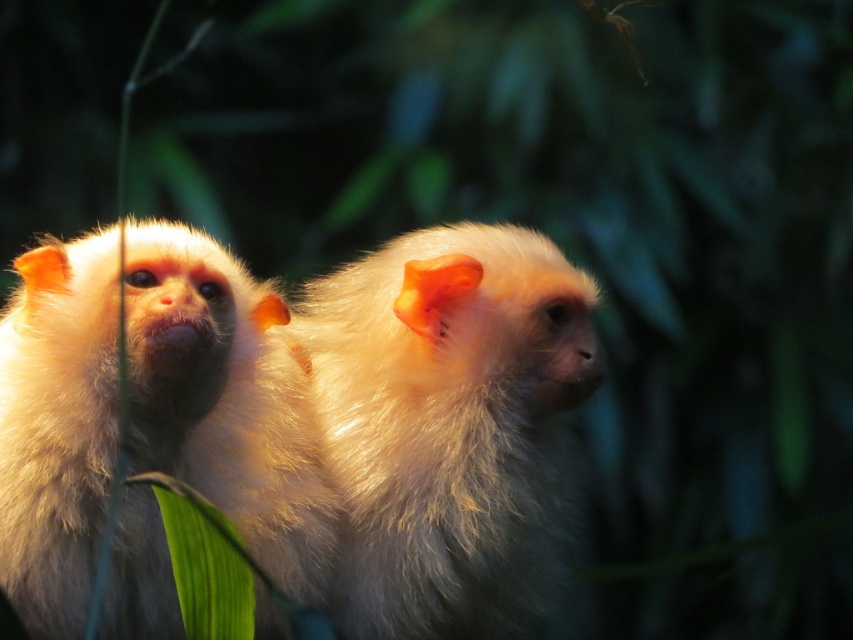
Question: Can you confirm if white fluffy monkey at center is positioned to the left of fluffy white monkey at center?

Choices:
 (A) no
 (B) yes

Answer: (B)

Question: Which point is closer to the camera?

Choices:
 (A) white fluffy monkey at center
 (B) fluffy white monkey at center

Answer: (A)

Question: Which object is farther from the camera taking this photo?

Choices:
 (A) fluffy white monkey at center
 (B) white fluffy monkey at center

Answer: (A)

Question: Does white fluffy monkey at center appear on the left side of fluffy white monkey at center?

Choices:
 (A) no
 (B) yes

Answer: (B)

Question: Can you confirm if white fluffy monkey at center is smaller than fluffy white monkey at center?

Choices:
 (A) no
 (B) yes

Answer: (A)

Question: Which point is closer to the camera?

Choices:
 (A) (152, 627)
 (B) (541, 518)

Answer: (A)